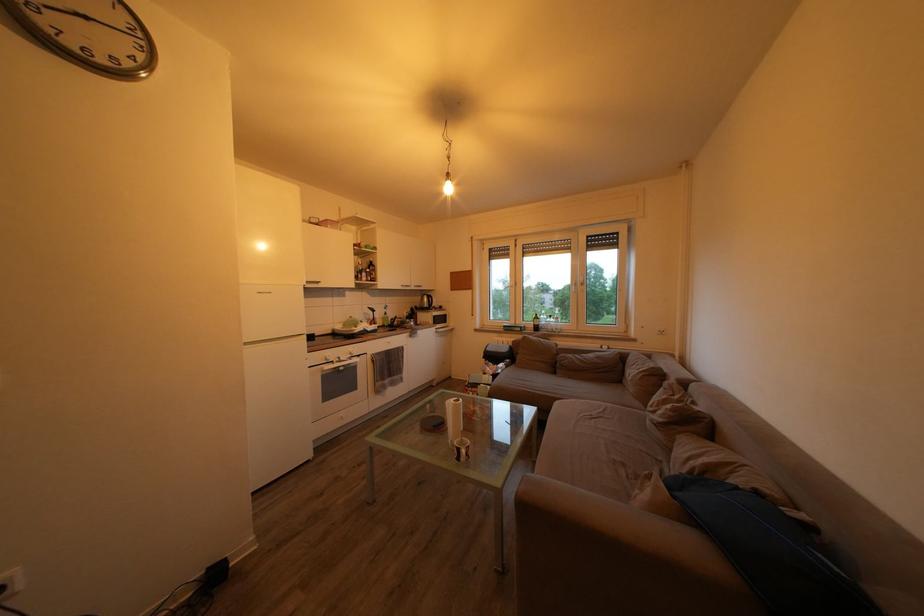
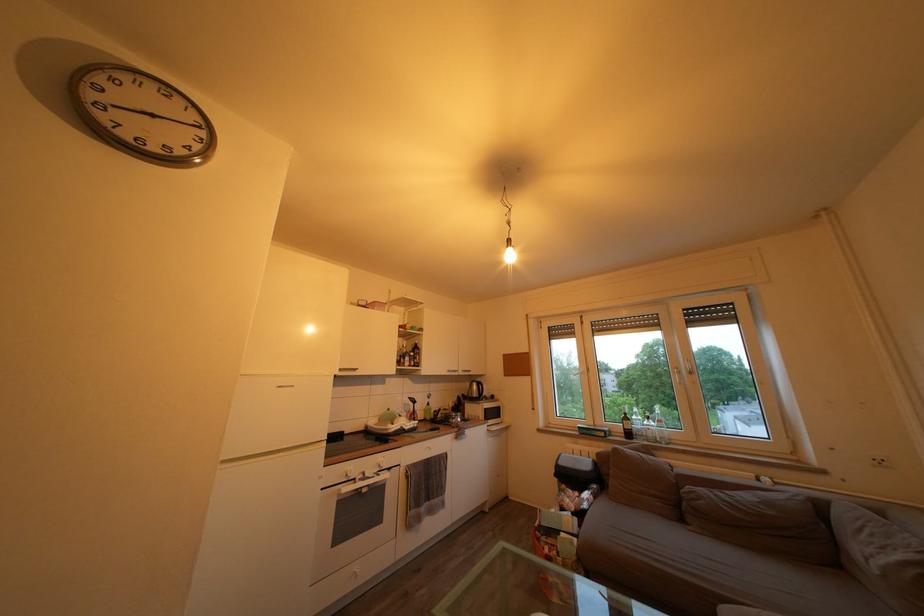
Locate, in the second image, the point that corresponds to (x=588, y=286) in the first image.

(691, 371)